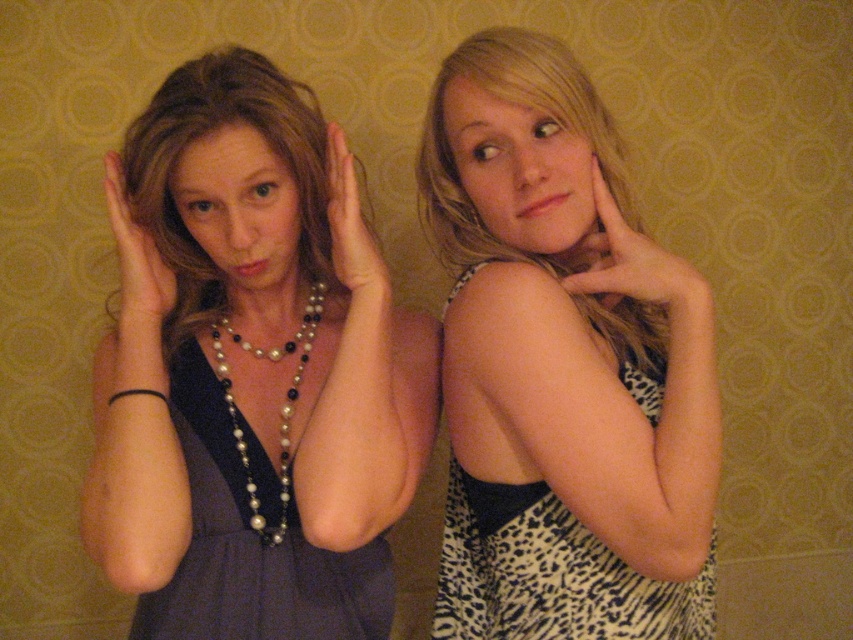
How far apart are matte black dress at left and dark blue satin dress at left?

matte black dress at left and dark blue satin dress at left are 3.20 inches apart from each other.

Is matte black dress at left below dark blue satin dress at left?

A: No.

Measure the distance between matte black dress at left and camera.

71.51 centimeters

Identify the location of matte black dress at left. (251, 371).

Can you confirm if leopard print dress at center is positioned to the left of smooth skin hand at right?

→ Yes, leopard print dress at center is to the left of smooth skin hand at right.

Who is positioned more to the left, leopard print dress at center or smooth skin hand at right?

Positioned to the left is leopard print dress at center.

This screenshot has width=853, height=640. I want to click on leopard print dress at center, so click(x=563, y=365).

Who is positioned more to the right, dark blue satin dress at left or pearl necklace at center?

From the viewer's perspective, pearl necklace at center appears more on the right side.

Is point (189, 592) closer to camera compared to point (195, 292)?

Yes.

At what (x,y) coordinates should I click in order to perform the action: click on dark blue satin dress at left. Please return your answer as a coordinate pair (x, y). The width and height of the screenshot is (853, 640). Looking at the image, I should click on (252, 545).